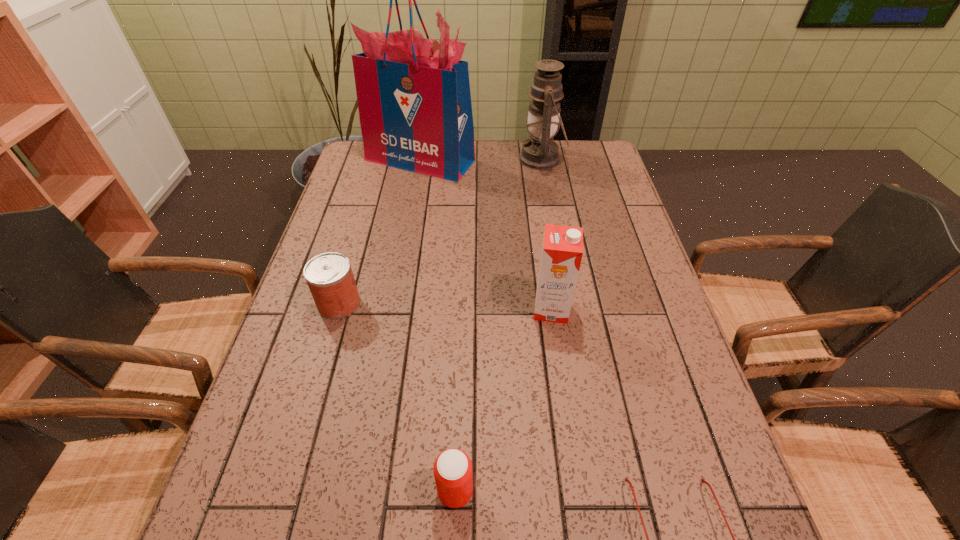
I want to click on empty space between the beer can and the fourth shortest object, so click(503, 400).

I want to click on object identified as the closest to the beer can, so click(x=626, y=479).

Locate which object is the fourth closest to the can. Please provide its 2D coordinates. Your answer should be formatted as a tuple, i.e. [(x, y)], where the tuple contains the x and y coordinates of a point satisfying the conditions above.

[(626, 479)]

Find the location of a particular element. free point that satisfies the following two spatial constraints: 1. on the back side of the beer can; 2. on the right side of the third tallest object is located at coordinates pyautogui.click(x=462, y=309).

This screenshot has width=960, height=540. Identify the location of free space that satisfies the following two spatial constraints: 1. on the back side of the carton; 2. on the right side of the beer can. (462, 309).